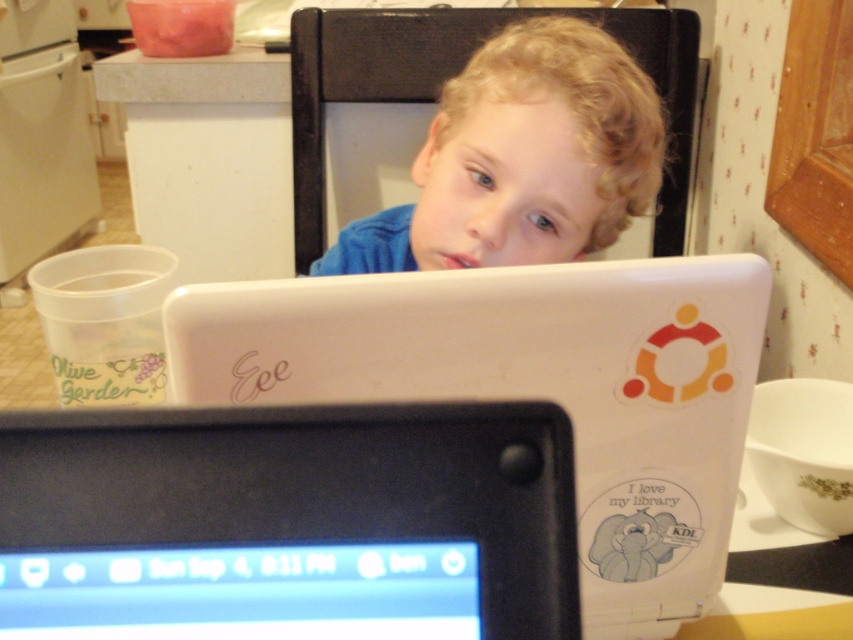
Is white matte laptop at center to the right of black glossy screen at center from the viewer's perspective?

Yes, white matte laptop at center is to the right of black glossy screen at center.

Which is below, white matte laptop at center or black glossy screen at center?

white matte laptop at center is below.

Who is more distant from viewer, (x=729, y=488) or (x=296, y=467)?

The point (x=729, y=488) is more distant.

Identify the location of white matte laptop at center. (531, 388).

Is white matte laptop at center positioned at the back of blonde curly hair at upper center?

No, it is not.

Who is higher up, white matte laptop at center or blonde curly hair at upper center?

blonde curly hair at upper center is higher up.

Is point (758, 310) in front of point (428, 200)?

Yes, it is.

Find the location of a particular element. Image resolution: width=853 pixels, height=640 pixels. white matte laptop at center is located at coordinates (531, 388).

The height and width of the screenshot is (640, 853). Describe the element at coordinates (531, 388) in the screenshot. I see `white matte laptop at center` at that location.

Locate an element on the screen. The image size is (853, 640). white matte laptop at center is located at coordinates 531,388.